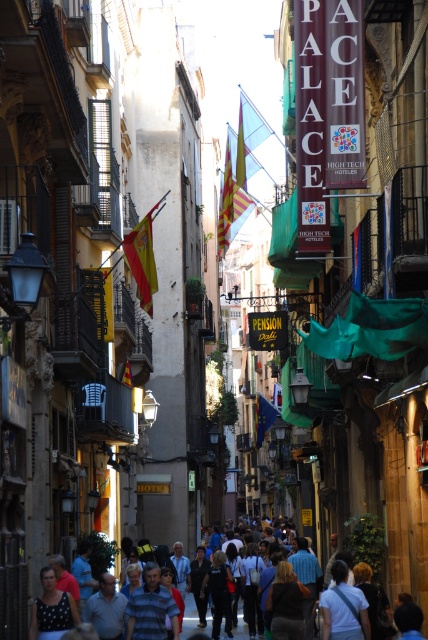
Question: Considering the relative positions of yellow fabric flag at center and light blue shirt at center in the image provided, where is yellow fabric flag at center located with respect to light blue shirt at center?

Choices:
 (A) right
 (B) left

Answer: (A)

Question: Which point is farther to the camera?

Choices:
 (A) (223, 196)
 (B) (145, 236)
 (C) (184, 624)

Answer: (A)

Question: From the image, what is the correct spatial relationship of matte fabric flag at center in relation to light blue shirt at center?

Choices:
 (A) above
 (B) below

Answer: (A)

Question: Which is nearer to the light blue shirt at center?

Choices:
 (A) yellow fabric flag at center
 (B) matte fabric flag at center

Answer: (B)

Question: Among these points, which one is nearest to the camera?

Choices:
 (A) (189, 605)
 (B) (231, 193)
 (C) (133, 230)

Answer: (C)

Question: Is yellow fabric flag at center below light blue shirt at center?

Choices:
 (A) no
 (B) yes

Answer: (A)